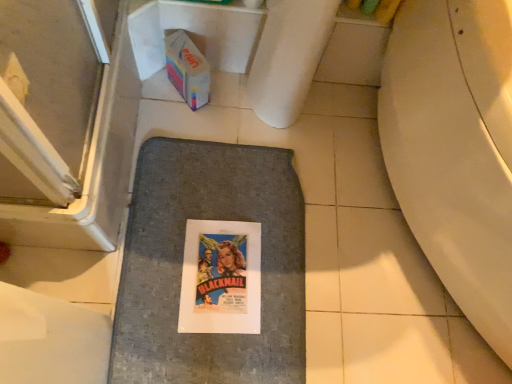
Locate an element on the screen. The width and height of the screenshot is (512, 384). free space that is in between multicolored cardboard box at upper left and gray fabric bath mat at center is located at coordinates (199, 135).